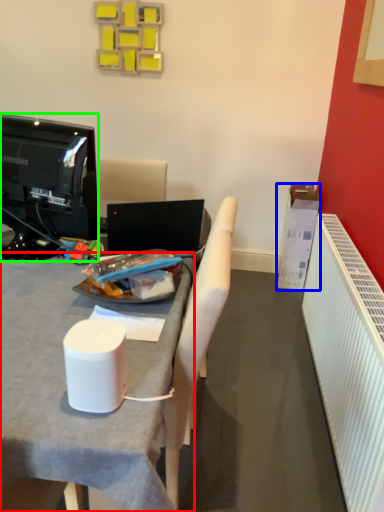
Question: Estimate the real-world distances between objects in this image. Which object is closer to desk (highlighted by a red box), box (highlighted by a blue box) or television (highlighted by a green box)?

Choices:
 (A) box
 (B) television

Answer: (B)